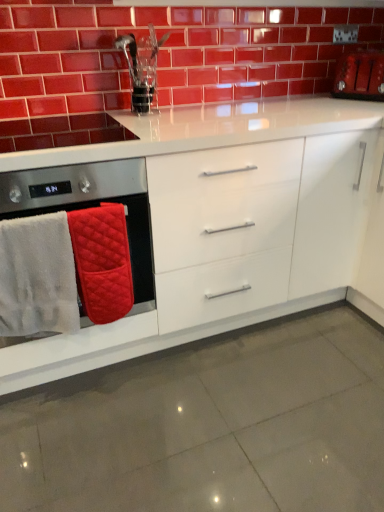
Question: Is matte red toaster at upper right to the left or to the right of quilted fabric oven mitts at left in the image?

Choices:
 (A) left
 (B) right

Answer: (B)

Question: Choose the correct answer: Is matte red toaster at upper right inside quilted fabric oven mitts at left or outside it?

Choices:
 (A) inside
 (B) outside

Answer: (B)

Question: Considering the real-world distances, which object is closest to the matte red toaster at upper right?

Choices:
 (A) glossy ceramic brickwork at upper center
 (B) white fluffy bath towel at left, the first bath towel in the left-to-right sequence
 (C) quilted fabric oven mitts at left
 (D) white glossy cabinet at center
 (E) red quilted bath towel at left, positioned as the 2th bath towel in left-to-right order

Answer: (A)

Question: Which of these objects is positioned closest to the glossy ceramic brickwork at upper center?

Choices:
 (A) white fluffy bath towel at left, the first bath towel in the left-to-right sequence
 (B) red quilted bath towel at left, positioned as the 2th bath towel in left-to-right order
 (C) white glossy cabinet at center
 (D) quilted fabric oven mitts at left
 (E) matte red toaster at upper right

Answer: (E)